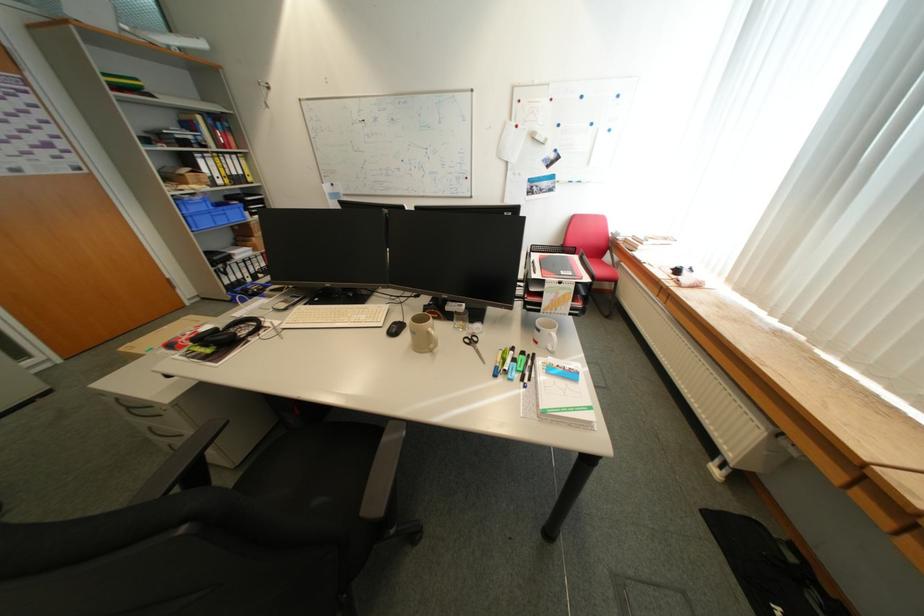
The location [225,334] corresponds to which object?

It corresponds to the black headphones in the image.